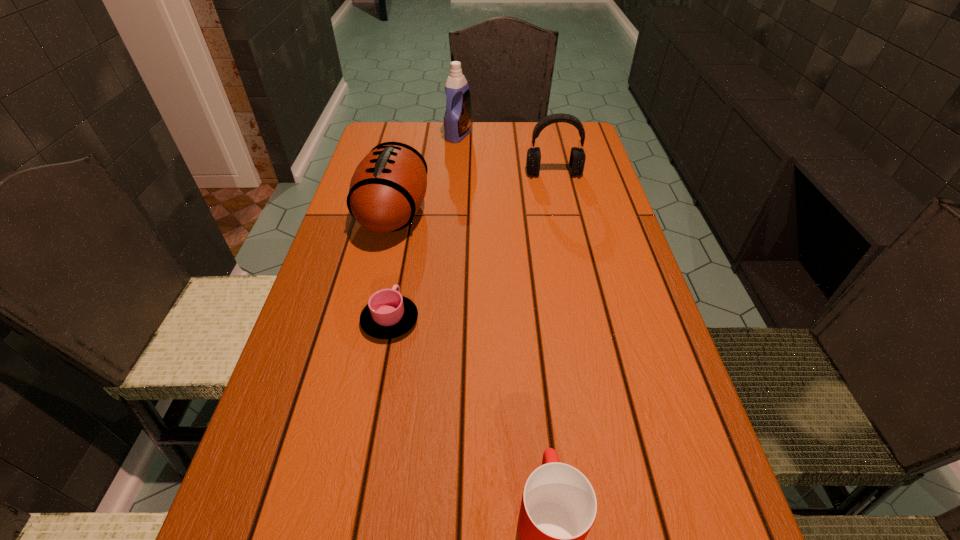
Locate an element on the screen. The image size is (960, 540). vacant space located 0.140m on the side with the handle of the fourth farthest object is located at coordinates (402, 256).

This screenshot has height=540, width=960. Find the location of `vacant space situated 0.350m on the side with the handle of the fourth farthest object`. vacant space situated 0.350m on the side with the handle of the fourth farthest object is located at coordinates (412, 204).

The height and width of the screenshot is (540, 960). What are the coordinates of `object that is at the far edge` in the screenshot? It's located at (457, 119).

Locate an element on the screen. Image resolution: width=960 pixels, height=540 pixels. football (American) that is at the left edge is located at coordinates (388, 187).

Find the location of a particular element. The image size is (960, 540). cup at the left edge is located at coordinates (388, 314).

Where is `object that is at the right edge`? This screenshot has width=960, height=540. object that is at the right edge is located at coordinates (577, 156).

Find the location of `vacant space at the far edge`. vacant space at the far edge is located at coordinates (499, 156).

Locate an element on the screen. free space at the left edge of the desktop is located at coordinates (297, 512).

Locate an element on the screen. The image size is (960, 540). free space at the right edge of the desktop is located at coordinates (634, 322).

The width and height of the screenshot is (960, 540). In order to click on vacant space at the far left corner in this screenshot , I will do [398, 122].